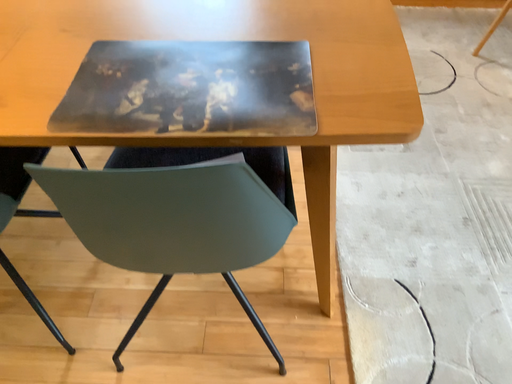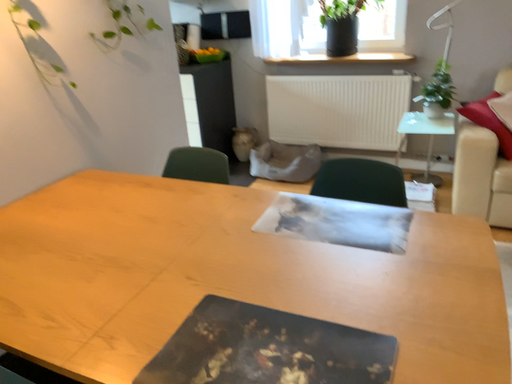
Question: How did the camera likely rotate when shooting the video?

Choices:
 (A) rotated right
 (B) rotated left

Answer: (B)